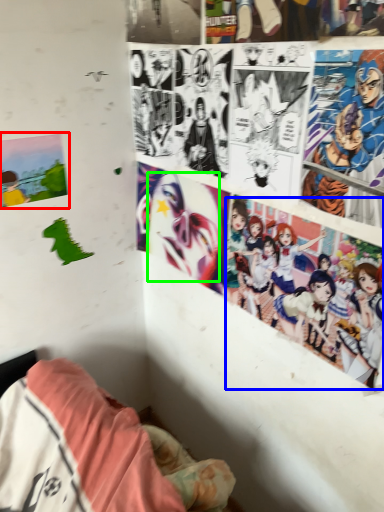
Question: Which is nearer to the poster page (highlighted by a red box)? person (highlighted by a blue box) or human face (highlighted by a green box).

Choices:
 (A) person
 (B) human face

Answer: (B)